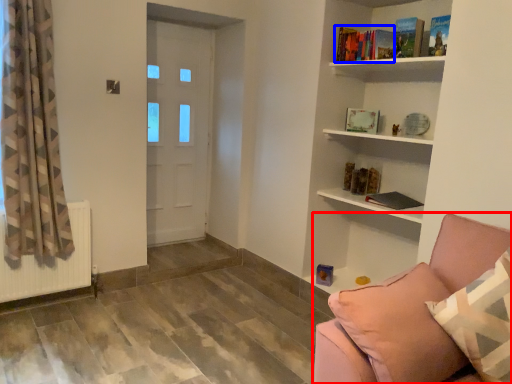
Question: Which of the following is the farthest to the observer, studio couch (highlighted by a red box) or book (highlighted by a blue box)?

Choices:
 (A) studio couch
 (B) book

Answer: (B)